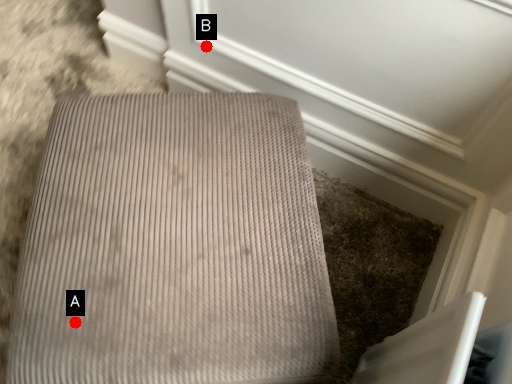
Question: Two points are circled on the image, labeled by A and B beside each circle. Which point is farther from the camera taking this photo?

Choices:
 (A) A is further
 (B) B is further

Answer: (B)